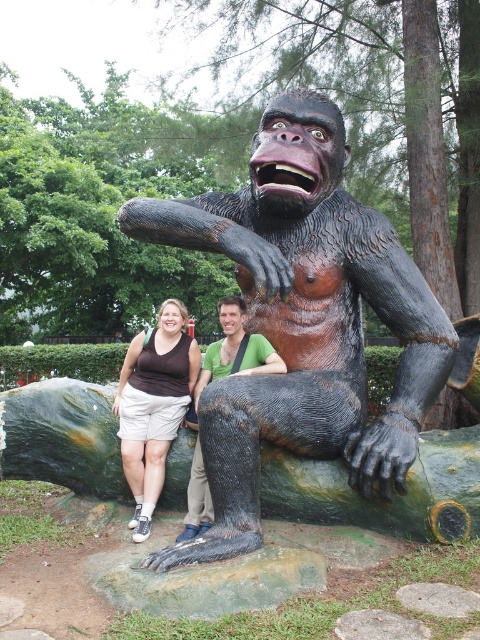
You are standing in front of the statue of the gorilla and want to place two markers at specific points on the statue. The markers are to be placed at point (350, 300) and point (192, 385). Which marker will appear closer to you when viewed from your current position?

Point (350, 300) is closer to the viewer than point (192, 385), so the marker placed at point (350, 300) will appear closer.

You are a photographer taking a picture of the two people next to the gorilla statue. You notice the brown cotton shorts at lower left and the green matte shirt at center. Which clothing item appears larger in the photo?

The brown cotton shorts at lower left appears larger than the green matte shirt at center in the photo.

You are a photographer trying to adjust the lighting for a photo shoot. You notice the brown cotton shorts at lower left and the green matte shirt at center. Which object should you focus the light on if you want to highlight the one that is taller?

The brown cotton shorts at lower left has a greater height compared to the green matte shirt at center, so you should focus the light on the brown cotton shorts at lower left to highlight the taller object.